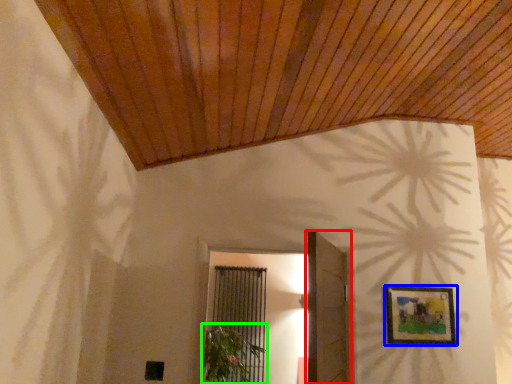
Question: Which object is positioned closest to door (highlighted by a red box)? Select from picture frame (highlighted by a blue box) and plant (highlighted by a green box).

Choices:
 (A) picture frame
 (B) plant

Answer: (A)